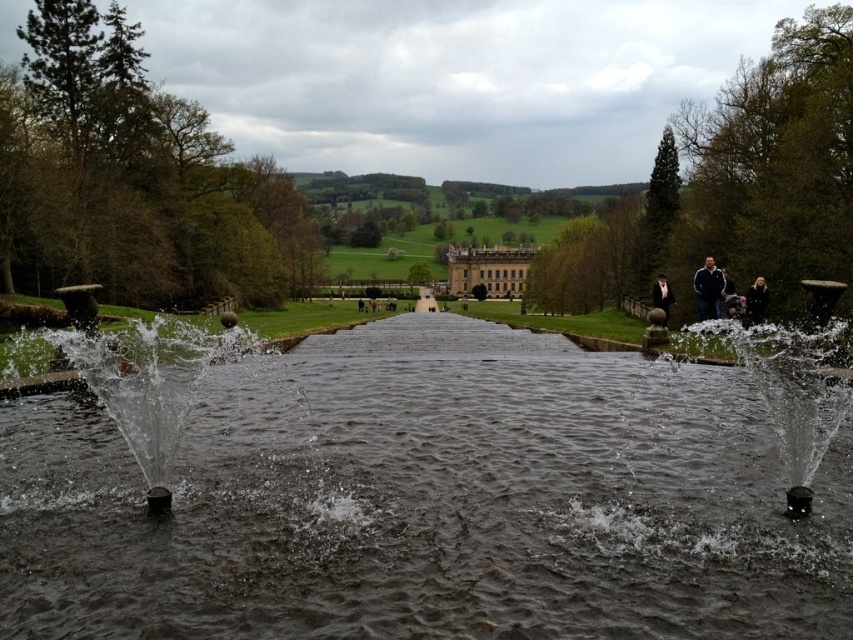
Question: Among these points, which one is farthest from the camera?

Choices:
 (A) (718, 296)
 (B) (610, 561)
 (C) (764, 310)
 (D) (666, 289)

Answer: (D)

Question: Is dark gray water at center closer to the viewer compared to metallic water at center?

Choices:
 (A) no
 (B) yes

Answer: (B)

Question: Considering the relative positions of dark blue jacket at upper right and black fabric person at right in the image provided, where is dark blue jacket at upper right located with respect to black fabric person at right?

Choices:
 (A) below
 (B) above

Answer: (B)

Question: Which point is closer to the camera?

Choices:
 (A) dark blue jacket at upper right
 (B) black fabric person at right
 (C) black velvet coat at right

Answer: (C)

Question: Which of these objects is positioned farthest from the metallic water at center?

Choices:
 (A) dark gray water at center
 (B) black velvet coat at right

Answer: (B)

Question: Is dark gray water at center to the right of black velvet coat at right from the viewer's perspective?

Choices:
 (A) yes
 (B) no

Answer: (B)